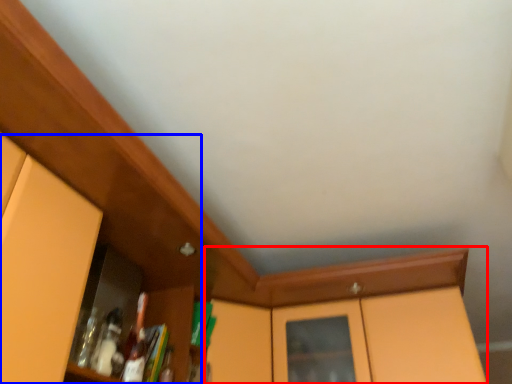
Question: Which object appears closest to the camera in this image, cabinetry (highlighted by a red box) or dresser (highlighted by a blue box)?

Choices:
 (A) cabinetry
 (B) dresser

Answer: (B)